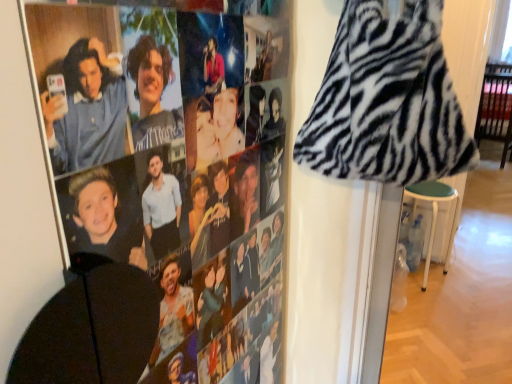
Question: Considering the positions of point (454, 221) and point (352, 62), is point (454, 221) closer or farther from the camera than point (352, 62)?

Choices:
 (A) closer
 (B) farther

Answer: (B)

Question: Is green fabric stool at lower right taller or shorter than zebra print fabric at upper right?

Choices:
 (A) tall
 (B) short

Answer: (A)

Question: Which is farther from the green fabric stool at lower right?

Choices:
 (A) zebra print fabric at upper right
 (B) zebra print hoodie at upper left

Answer: (B)

Question: Which of these objects is positioned farthest from the green fabric stool at lower right?

Choices:
 (A) zebra print fabric at upper right
 (B) zebra print hoodie at upper left

Answer: (B)